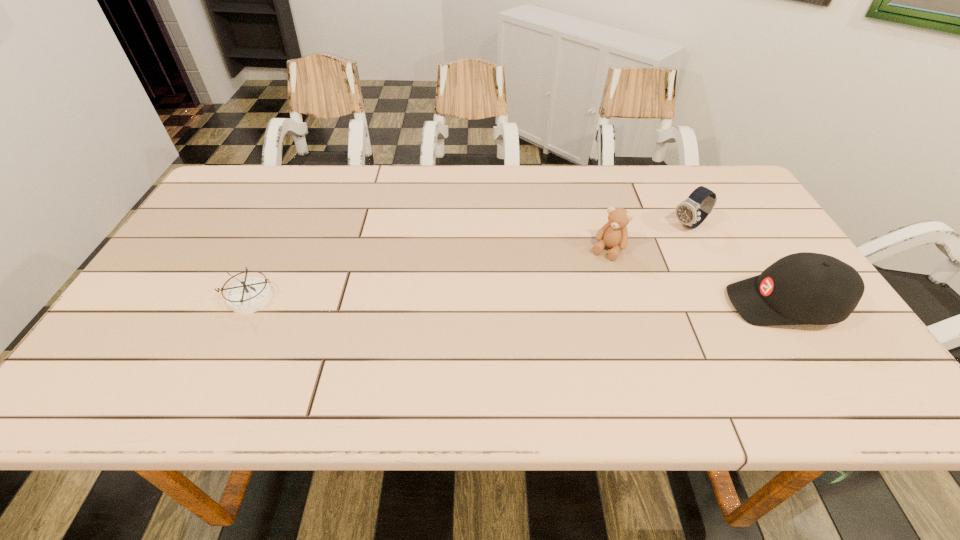
This screenshot has width=960, height=540. I want to click on free spot on the desktop that is between the leftmost object and the baseball cap and is positioned on the face of the watch, so click(549, 301).

Where is `vacant space on the desktop that is between the shortest object and the baseball cap and is positioned on the front-facing side of the teddy bear`? This screenshot has height=540, width=960. vacant space on the desktop that is between the shortest object and the baseball cap and is positioned on the front-facing side of the teddy bear is located at coordinates (575, 302).